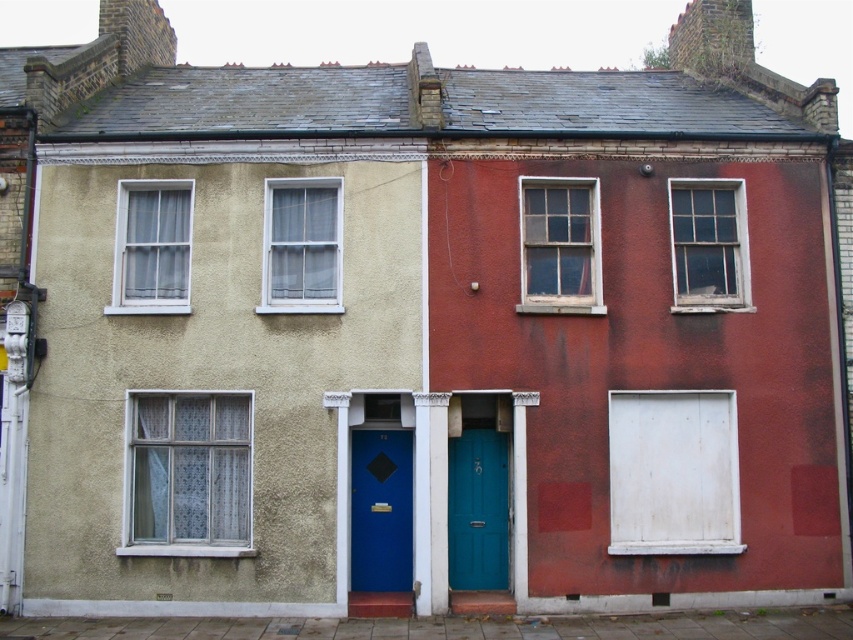
Question: Can you confirm if white textured window at upper left is bigger than blue matte door at center?

Choices:
 (A) no
 (B) yes

Answer: (B)

Question: Which point is farther to the camera?

Choices:
 (A) (131, 512)
 (B) (521, 192)

Answer: (B)

Question: Does white lace curtain at center appear over white textured window at upper left?

Choices:
 (A) no
 (B) yes

Answer: (A)

Question: Considering the real-world distances, which object is farthest from the clear glass window at upper right?

Choices:
 (A) white lace curtain at center
 (B) blue matte door at center

Answer: (A)

Question: Which of the following is the farthest from the observer?

Choices:
 (A) (466, 570)
 (B) (364, 570)
 (C) (309, 202)

Answer: (C)

Question: Is clear glass window at upper right wider than white textured window at upper left?

Choices:
 (A) no
 (B) yes

Answer: (A)